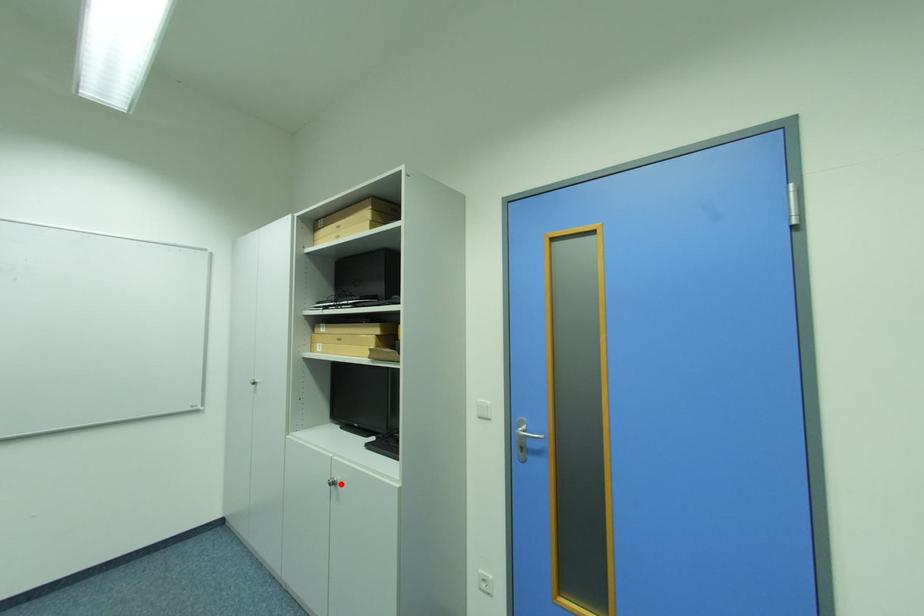
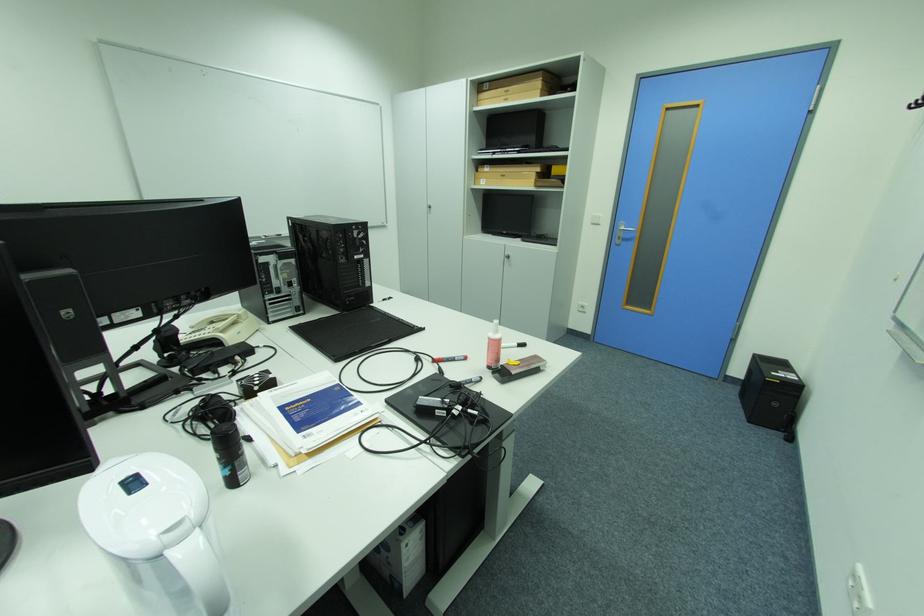
In the second image, find the point that corresponds to the highlighted location in the first image.

(516, 257)